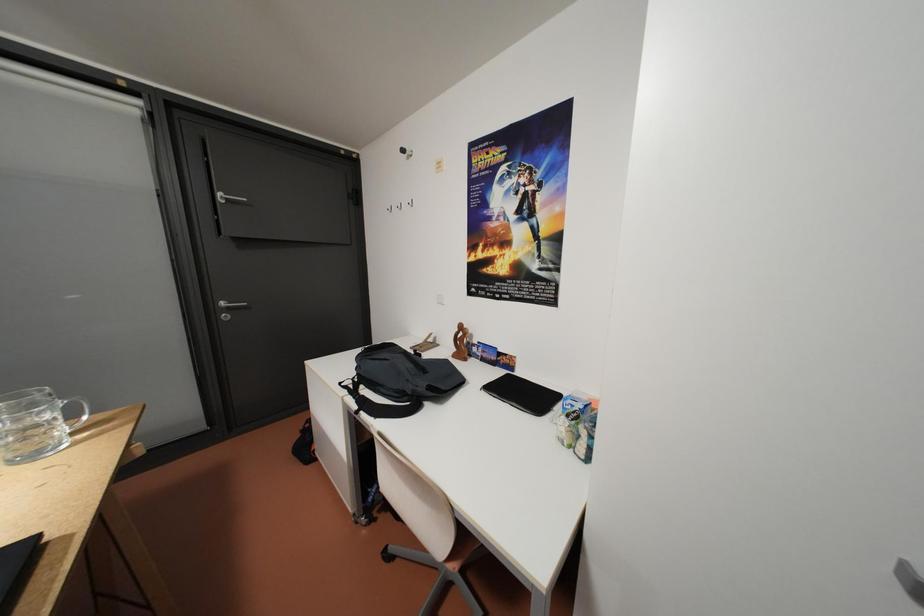
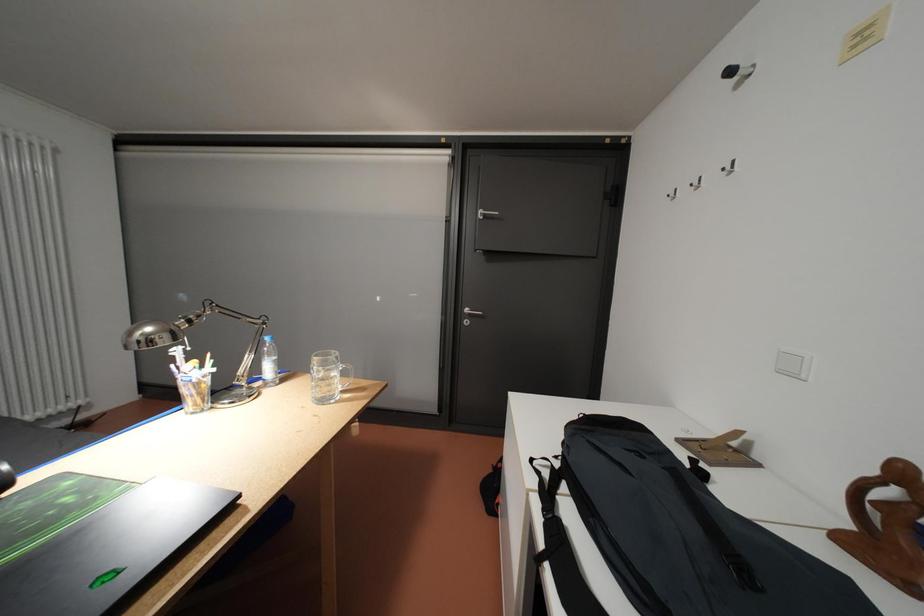
Question: Based on the continuous images, in which direction is the camera rotating? Reply with the corresponding letter.

Choices:
 (A) Left
 (B) Right
 (C) Up
 (D) Down

Answer: (A)